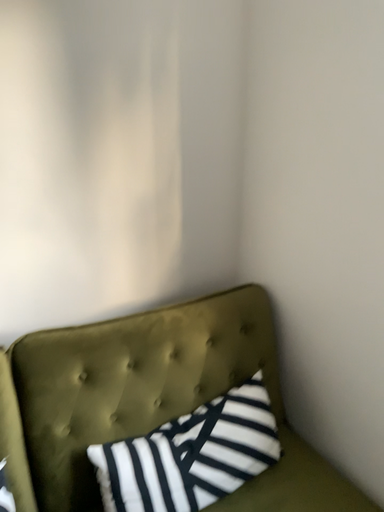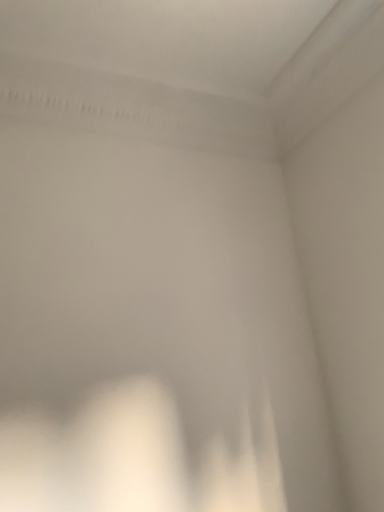
Question: How did the camera likely rotate when shooting the video?

Choices:
 (A) rotated right
 (B) rotated left

Answer: (B)